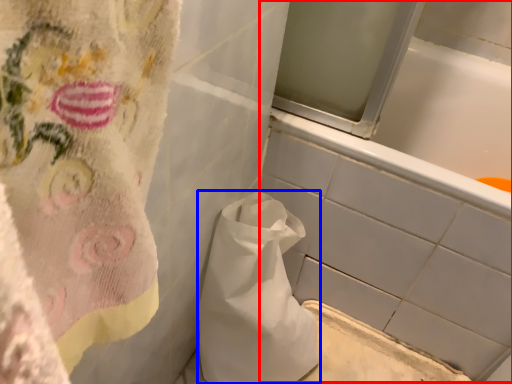
Question: Which point is closer to the camera, bath (highlighted by a red box) or paper bag (highlighted by a blue box)?

Choices:
 (A) bath
 (B) paper bag

Answer: (B)